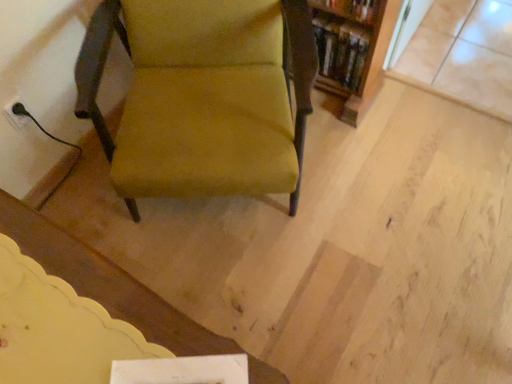
Question: Considering the positions of velvet mustard chair at center and wooden bookshelf at upper right in the image, is velvet mustard chair at center bigger or smaller than wooden bookshelf at upper right?

Choices:
 (A) small
 (B) big

Answer: (B)

Question: In the image, is velvet mustard chair at center positioned in front of or behind wooden bookshelf at upper right?

Choices:
 (A) behind
 (B) front

Answer: (B)

Question: From a real-world perspective, is velvet mustard chair at center positioned above or below wooden bookshelf at upper right?

Choices:
 (A) below
 (B) above

Answer: (B)

Question: From the image's perspective, is wooden bookshelf at upper right located above or below velvet mustard chair at center?

Choices:
 (A) above
 (B) below

Answer: (A)

Question: Considering the positions of wooden bookshelf at upper right and velvet mustard chair at center in the image, is wooden bookshelf at upper right bigger or smaller than velvet mustard chair at center?

Choices:
 (A) big
 (B) small

Answer: (B)

Question: From a real-world perspective, is wooden bookshelf at upper right physically located above or below velvet mustard chair at center?

Choices:
 (A) below
 (B) above

Answer: (A)

Question: Looking at their shapes, would you say wooden bookshelf at upper right is wider or thinner than velvet mustard chair at center?

Choices:
 (A) wide
 (B) thin

Answer: (B)